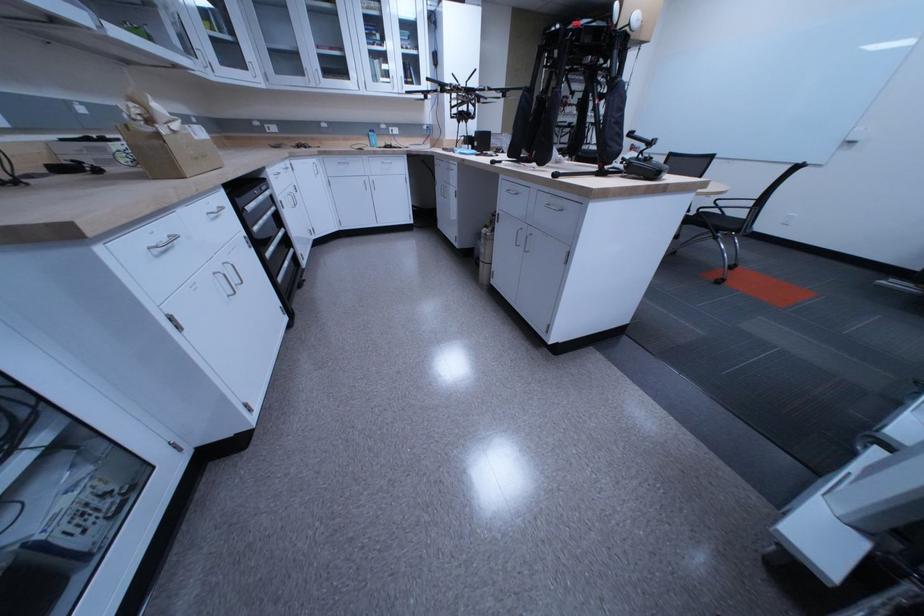
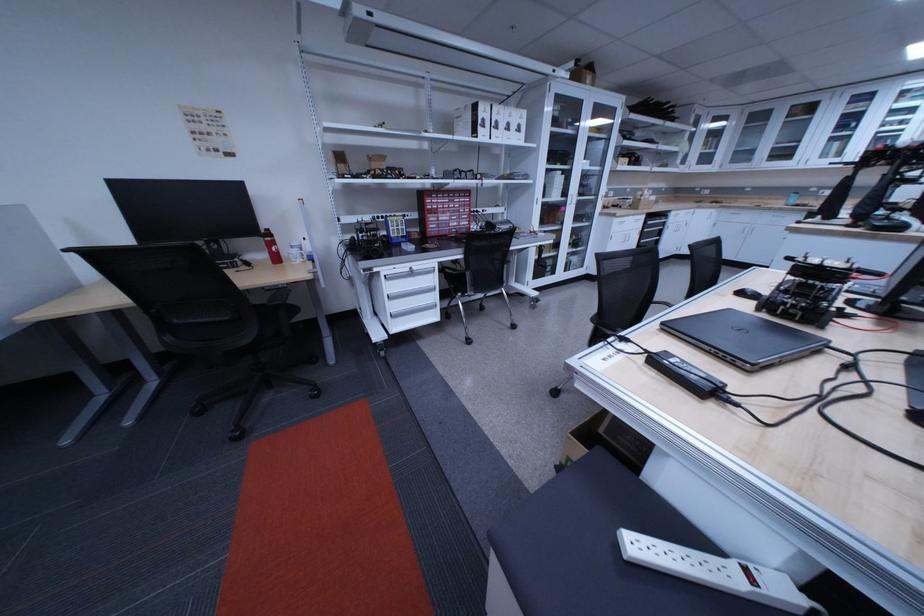
Locate, in the second image, the point that corresponds to the point at 390,169 in the first image.

(779, 220)